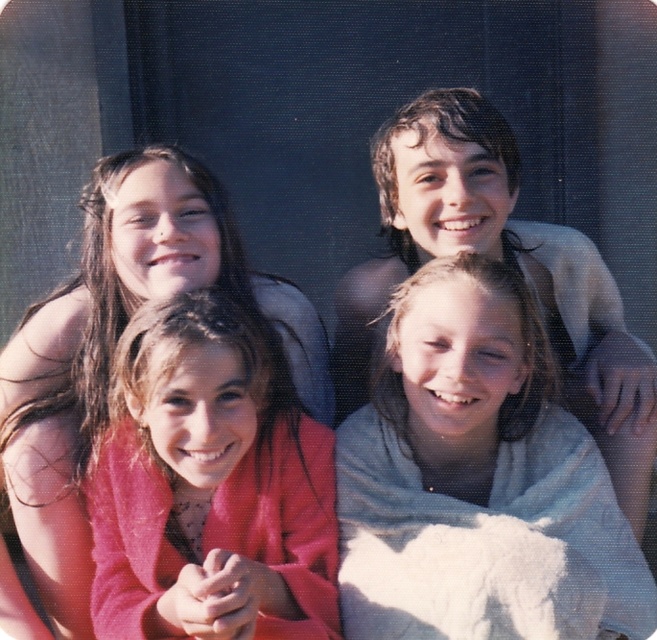
You are standing in the scene and want to walk towards the point that is closer to you. Which point should you head towards, point (164, 627) or point (585, 253)?

You should head towards point (164, 627) because it is in front of point (585, 253), meaning it is closer to you.